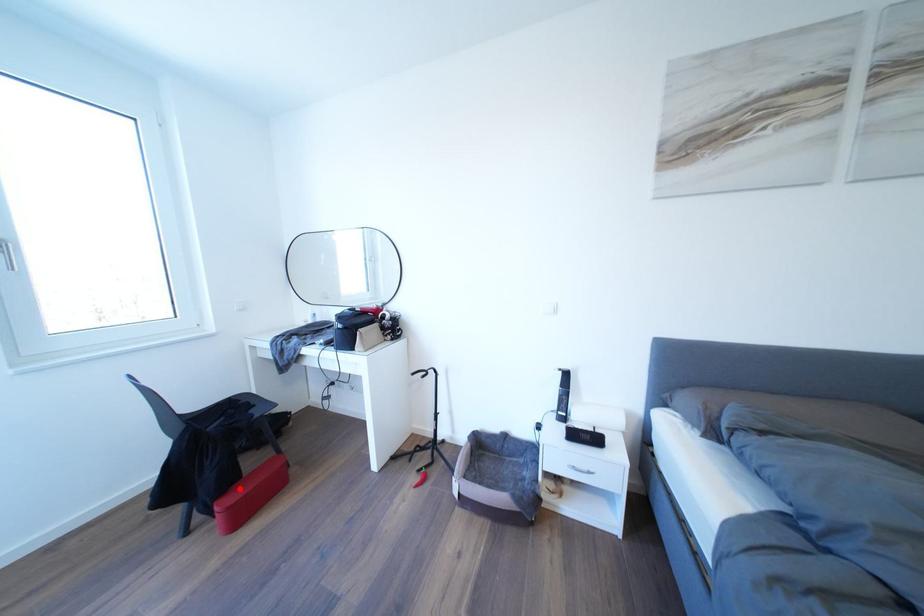
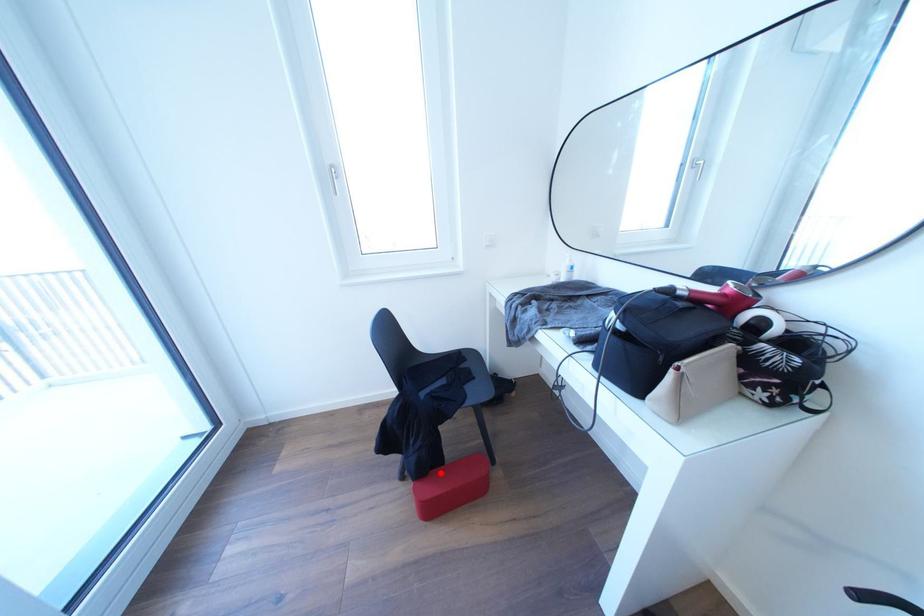
I am providing you with two images of the same scene from different viewpoints. A red point is marked on the first image and another point is marked on the second image. Is the red point in image1 aligned with the point shown in image2?

Yes